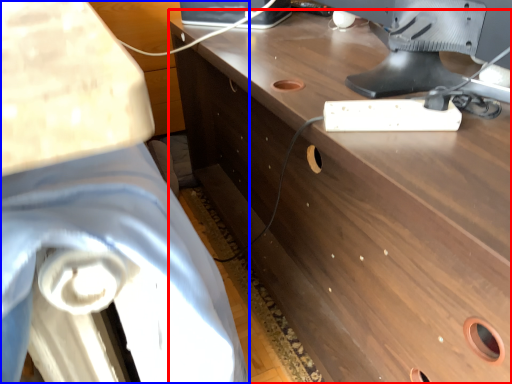
Question: Which object appears farthest to the camera in this image, desk (highlighted by a red box) or swivel chair (highlighted by a blue box)?

Choices:
 (A) desk
 (B) swivel chair

Answer: (A)